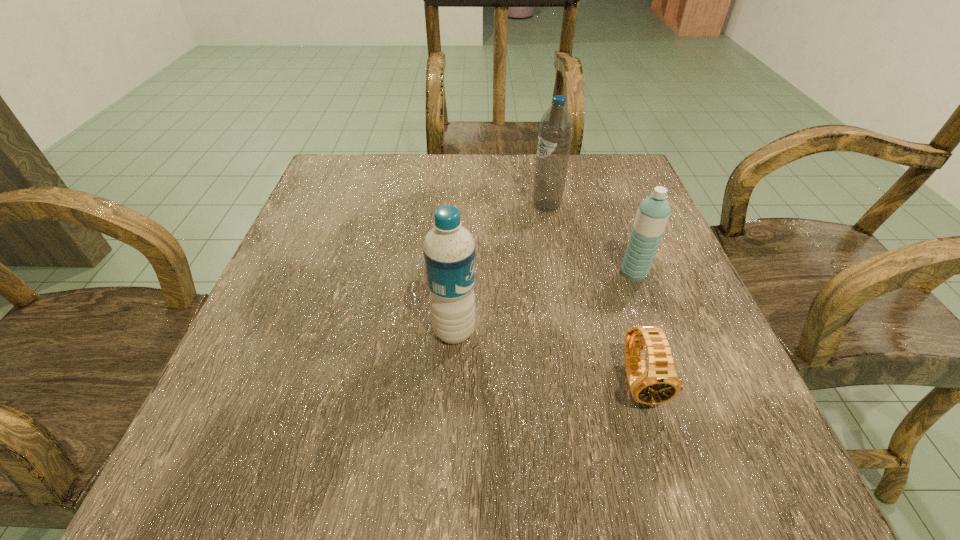
Identify the location of vacant area that lies between the second farthest water bottle and the leftmost object. The height and width of the screenshot is (540, 960). (544, 302).

I want to click on free space between the shortest object and the second object from left to right, so click(x=593, y=294).

Where is `free spot between the leftmost water bottle and the watch`? free spot between the leftmost water bottle and the watch is located at coordinates (547, 357).

Image resolution: width=960 pixels, height=540 pixels. I want to click on object that is the closest to the watch, so click(653, 213).

Find the location of a particular element. Image resolution: width=960 pixels, height=540 pixels. object that stands as the third closest to the nearest water bottle is located at coordinates (555, 132).

Identify which water bottle is located as the third nearest to the nearest object. Please provide its 2D coordinates. Your answer should be formatted as a tuple, i.e. [(x, y)], where the tuple contains the x and y coordinates of a point satisfying the conditions above.

[(555, 132)]

Where is `the closest water bottle to the second object from left to right`? The image size is (960, 540). the closest water bottle to the second object from left to right is located at coordinates (653, 213).

The width and height of the screenshot is (960, 540). Find the location of `free location that satisfies the following two spatial constraints: 1. on the front side of the farthest object; 2. on the label of the leftmost object`. free location that satisfies the following two spatial constraints: 1. on the front side of the farthest object; 2. on the label of the leftmost object is located at coordinates (570, 331).